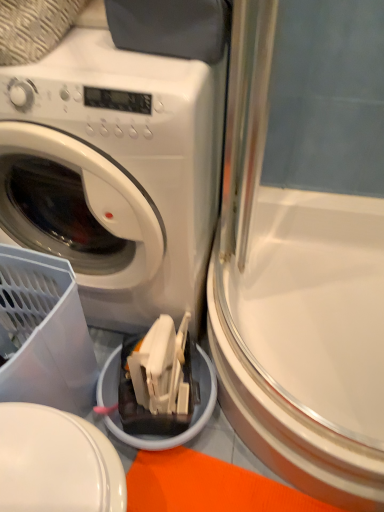
You are a GUI agent. You are given a task and a screenshot of the screen. Output one action in this format:
    pyautogui.click(x=<x>, y=<y>)
    Task: Click on the white glossy screen door at lower right
    
    Given the screenshot: What is the action you would take?
    click(x=304, y=246)

Image resolution: width=384 pixels, height=512 pixels. Describe the element at coordinates (304, 246) in the screenshot. I see `white glossy screen door at lower right` at that location.

Measure the distance between white glossy screen door at lower right and camera.

white glossy screen door at lower right and camera are 25.40 inches apart from each other.

What is the approximate height of white glossy washing machine at upper left?

white glossy washing machine at upper left is 85.29 centimeters tall.

Locate an element on the screen. This screenshot has height=512, width=384. white glossy washing machine at upper left is located at coordinates (116, 173).

In order to face white glossy washing machine at upper left, should I rotate leftwards or rightwards?

A 11.198 degree turn to the left will do.

What do you see at coordinates (116, 173) in the screenshot? The width and height of the screenshot is (384, 512). I see `white glossy washing machine at upper left` at bounding box center [116, 173].

At what (x,y) coordinates should I click in order to perform the action: click on white glossy screen door at lower right. Please return your answer as a coordinate pair (x, y). The width and height of the screenshot is (384, 512). Looking at the image, I should click on (304, 246).

Is white glossy screen door at lower right at the right side of white glossy washing machine at upper left?

Yes.

Does white glossy screen door at lower right lie in front of white glossy washing machine at upper left?

No, white glossy screen door at lower right is further to the viewer.

Looking at this image, which is closer, (254, 307) or (94, 178)?

Point (254, 307) is positioned farther from the camera compared to point (94, 178).

From the image's perspective, which one is positioned higher, white glossy screen door at lower right or white glossy washing machine at upper left?

white glossy washing machine at upper left, from the image's perspective.

From a real-world perspective, is white glossy screen door at lower right over white glossy washing machine at upper left?

No.

Looking at this image, which of these two, white glossy screen door at lower right or white glossy washing machine at upper left, is thinner?

white glossy washing machine at upper left is thinner.

Considering the relative sizes of white glossy screen door at lower right and white glossy washing machine at upper left in the image provided, is white glossy screen door at lower right taller than white glossy washing machine at upper left?

In fact, white glossy screen door at lower right may be shorter than white glossy washing machine at upper left.

In the scene shown: Does white glossy screen door at lower right have a larger size compared to white glossy washing machine at upper left?

No, white glossy screen door at lower right is not bigger than white glossy washing machine at upper left.

Is white glossy screen door at lower right not within white glossy washing machine at upper left?

white glossy screen door at lower right lies outside white glossy washing machine at upper left's area.

Is white glossy screen door at lower right far from white glossy washing machine at upper left?

They are positioned close to each other.

Is white glossy screen door at lower right aimed at white glossy washing machine at upper left?

No, white glossy screen door at lower right is not aimed at white glossy washing machine at upper left.

Could you measure the distance between white glossy screen door at lower right and white glossy washing machine at upper left?

white glossy screen door at lower right and white glossy washing machine at upper left are 11.11 inches apart.

Image resolution: width=384 pixels, height=512 pixels. What are the coordinates of `washing machine on the left of the white glossy screen door at lower right` in the screenshot? It's located at pyautogui.click(x=116, y=173).

Which object is positioned more to the left, white glossy washing machine at upper left or white glossy screen door at lower right?

Positioned to the left is white glossy washing machine at upper left.

Which object is closer to the camera, white glossy washing machine at upper left or white glossy screen door at lower right?

white glossy washing machine at upper left.

From the picture: Which is nearer, (71, 257) or (298, 217)?

Point (71, 257) appears to be closer to the viewer than point (298, 217).

From the image's perspective, is white glossy washing machine at upper left positioned above or below white glossy screen door at lower right?

Clearly, from the image's perspective, white glossy washing machine at upper left is above white glossy screen door at lower right.

From a real-world perspective, does white glossy washing machine at upper left sit lower than white glossy screen door at lower right?

No, from a real-world perspective, white glossy washing machine at upper left is not below white glossy screen door at lower right.

Which of these two, white glossy washing machine at upper left or white glossy screen door at lower right, is thinner?

white glossy washing machine at upper left is thinner.

Between white glossy washing machine at upper left and white glossy screen door at lower right, which one has less height?

With less height is white glossy screen door at lower right.

Based on their sizes in the image, would you say white glossy washing machine at upper left is bigger or smaller than white glossy screen door at lower right?

Clearly, white glossy washing machine at upper left is larger in size than white glossy screen door at lower right.

Consider the image. Could white glossy screen door at lower right be considered to be inside white glossy washing machine at upper left?

No.

Is white glossy washing machine at upper left next to white glossy screen door at lower right?

No, white glossy washing machine at upper left is not making contact with white glossy screen door at lower right.

Looking at this image, is white glossy washing machine at upper left oriented towards white glossy screen door at lower right?

No.

Can you tell me how much white glossy washing machine at upper left and white glossy screen door at lower right differ in facing direction?

The facing directions of white glossy washing machine at upper left and white glossy screen door at lower right are 0.137 degrees apart.

Consider the image. Measure the distance from white glossy washing machine at upper left to white glossy screen door at lower right.

white glossy washing machine at upper left and white glossy screen door at lower right are 11.11 inches apart from each other.

What are the coordinates of `screen door below the white glossy washing machine at upper left (from a real-world perspective)` in the screenshot? It's located at (304, 246).

You are a GUI agent. You are given a task and a screenshot of the screen. Output one action in this format:
    pyautogui.click(x=<x>, y=<y>)
    Task: Click on the screen door below the white glossy washing machine at upper left (from the image's perspective)
    Image resolution: width=384 pixels, height=512 pixels.
    Given the screenshot: What is the action you would take?
    pyautogui.click(x=304, y=246)

At what (x,y) coordinates should I click in order to perform the action: click on screen door to the right of white glossy washing machine at upper left. Please return your answer as a coordinate pair (x, y). Looking at the image, I should click on (304, 246).